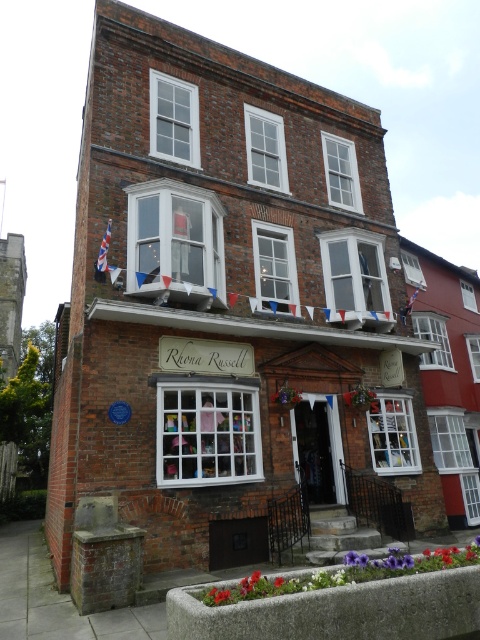
Question: Does union jack fabric flag at upper left appear over blue fabric flag at upper center?

Choices:
 (A) yes
 (B) no

Answer: (A)

Question: Is union jack fabric flag at upper left behind blue fabric flag at upper center?

Choices:
 (A) no
 (B) yes

Answer: (A)

Question: Which point appears farthest from the camera in this image?

Choices:
 (A) (106, 248)
 (B) (411, 304)

Answer: (B)

Question: Is union jack fabric flag at upper left behind blue fabric flag at upper center?

Choices:
 (A) no
 (B) yes

Answer: (A)